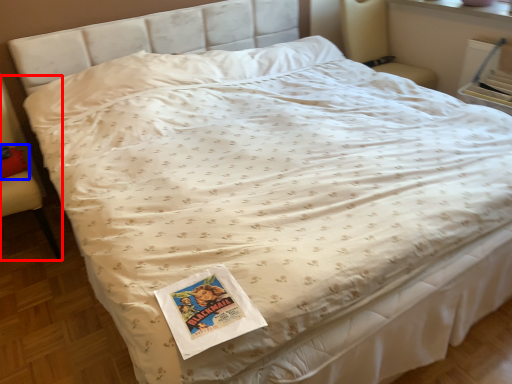
Question: Which point is closer to the camera, armchair (highlighted by a red box) or pillow (highlighted by a blue box)?

Choices:
 (A) armchair
 (B) pillow

Answer: (A)